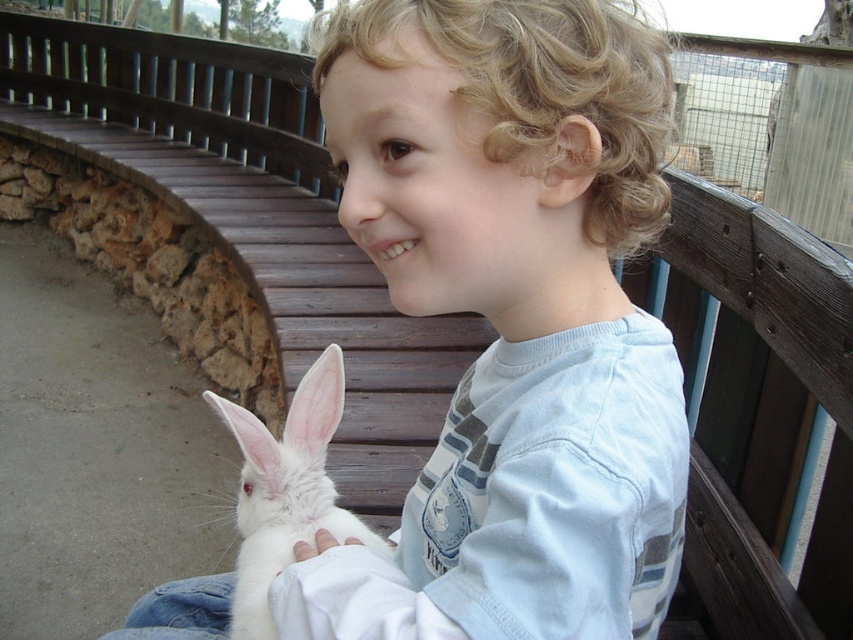
You are a zookeeper who needs to place two rabbits in separate cages. You have a cage that can accommodate rabbits up to 30 cm in width. You see the white soft fur rabbit at center and the white fluffy rabbit at lower left. Can both rabbits fit into the cage if placed individually?

The white soft fur rabbit at center might be wider than white fluffy rabbit at lower left. Since the cage can hold up to 30 cm, if the wider rabbit is within this limit, both could fit individually. However, if the wider rabbit exceeds 30 cm, only the narrower one would fit.

You are a zookeeper who needs to place two rabbits in their enclosure. You have a white soft fur rabbit at center and a white fluffy rabbit at lower left. According to their positions in the image, which rabbit is positioned more to the right?

The white soft fur rabbit at center is positioned more to the right compared to the white fluffy rabbit at lower left.